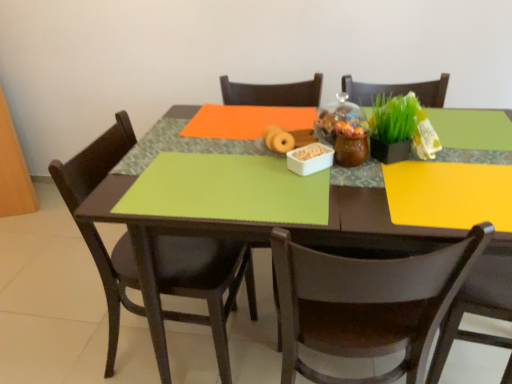
Question: Is brown wooden chair at lower right, the 1th chair when ordered from right to left, positioned behind matte brown donut at center?

Choices:
 (A) no
 (B) yes

Answer: (A)

Question: Can you confirm if brown wooden chair at lower right, the 1th chair when ordered from right to left, is thinner than matte brown donut at center?

Choices:
 (A) yes
 (B) no

Answer: (B)

Question: Does brown wooden chair at lower right, the 2th chair from the left, appear on the right side of matte brown donut at center?

Choices:
 (A) no
 (B) yes

Answer: (B)

Question: Does brown wooden chair at lower right, the 1th chair when ordered from right to left, have a lesser height compared to matte brown donut at center?

Choices:
 (A) yes
 (B) no

Answer: (B)

Question: From a real-world perspective, is brown wooden chair at lower right, the 2th chair from the left, physically below matte brown donut at center?

Choices:
 (A) no
 (B) yes

Answer: (B)

Question: Considering the positions of green matte placemat at center and matte brown donut at center in the image, is green matte placemat at center taller or shorter than matte brown donut at center?

Choices:
 (A) short
 (B) tall

Answer: (B)

Question: Is green matte placemat at center bigger or smaller than matte brown donut at center?

Choices:
 (A) small
 (B) big

Answer: (B)

Question: Visually, is green matte placemat at center positioned to the left or to the right of matte brown donut at center?

Choices:
 (A) right
 (B) left

Answer: (A)

Question: From a real-world perspective, relative to matte brown donut at center, is green matte placemat at center vertically above or below?

Choices:
 (A) above
 (B) below

Answer: (B)

Question: Considering the positions of matte brown donut at center and matte black chair at left, which ranks as the first chair in left-to-right order, in the image, is matte brown donut at center bigger or smaller than matte black chair at left, which ranks as the first chair in left-to-right order,?

Choices:
 (A) small
 (B) big

Answer: (A)

Question: Is matte brown donut at center in front of or behind matte black chair at left, which is the 2th chair in right-to-left order, in the image?

Choices:
 (A) behind
 (B) front

Answer: (A)

Question: In terms of width, does matte brown donut at center look wider or thinner when compared to matte black chair at left, which ranks as the first chair in left-to-right order?

Choices:
 (A) thin
 (B) wide

Answer: (A)

Question: From the image's perspective, is matte brown donut at center positioned above or below matte black chair at left, which is the 2th chair in right-to-left order?

Choices:
 (A) above
 (B) below

Answer: (A)

Question: From a real-world perspective, relative to matte brown donut at center, is matte black chair at left, which ranks as the first chair in left-to-right order, vertically above or below?

Choices:
 (A) above
 (B) below

Answer: (B)

Question: Is matte black chair at left, which is the 2th chair in right-to-left order, in front of or behind matte brown donut at center in the image?

Choices:
 (A) behind
 (B) front

Answer: (B)